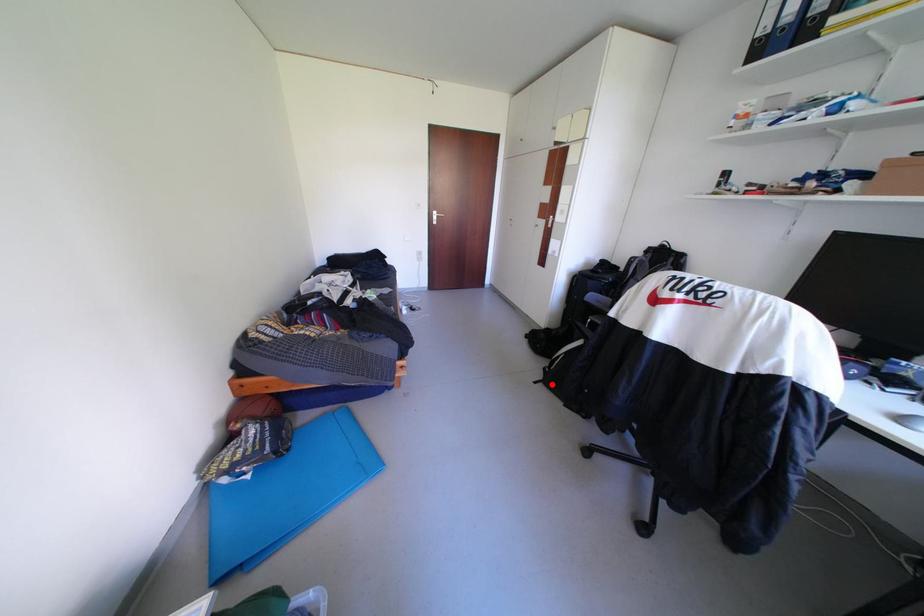
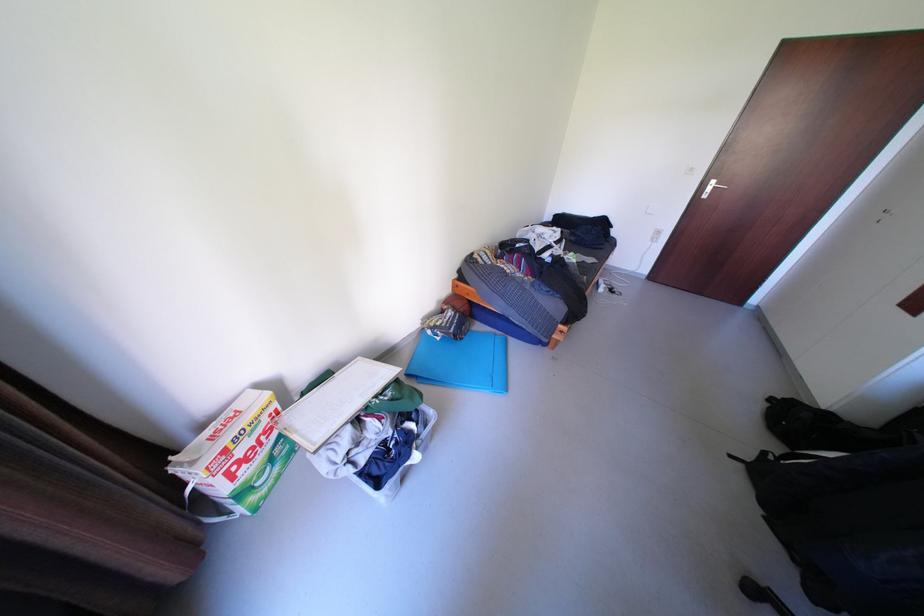
Question: I am providing you with two images of the same scene from different viewpoints. A red point is marked on the first image. At the location where the point appears in image 1, is it still visible in image 2?

Choices:
 (A) Yes
 (B) No

Answer: (A)